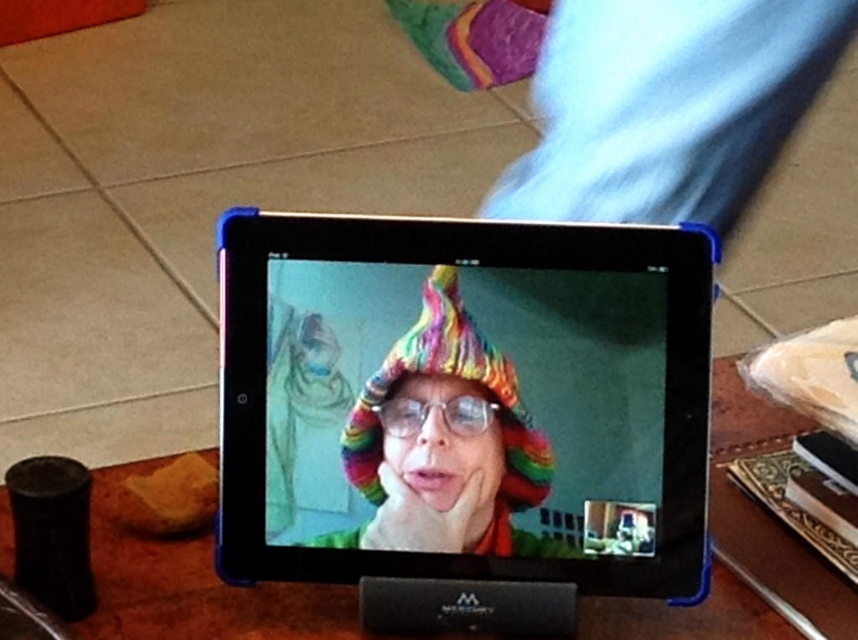
Can you confirm if black plastic tablet at center is positioned below rainbow knitted hat at center?

No, black plastic tablet at center is not below rainbow knitted hat at center.

The width and height of the screenshot is (858, 640). Describe the element at coordinates (464, 394) in the screenshot. I see `black plastic tablet at center` at that location.

Between point (307, 497) and point (469, 314), which one is positioned behind?

The point (307, 497) is behind.

I want to click on black plastic tablet at center, so click(x=464, y=394).

Can you confirm if black plastic tablet at center is smaller than wooden table at center?

Yes.

Can you confirm if black plastic tablet at center is thinner than wooden table at center?

Yes, black plastic tablet at center is thinner than wooden table at center.

Is point (523, 513) in front of point (458, 637)?

That is True.

Find the location of a particular element. This screenshot has width=858, height=640. black plastic tablet at center is located at coordinates (464, 394).

How far apart are wooden table at center and rainbow knitted hat at center?

wooden table at center and rainbow knitted hat at center are 8.06 inches apart from each other.

Does wooden table at center lie behind rainbow knitted hat at center?

That is False.

At what (x,y) coordinates should I click in order to perform the action: click on wooden table at center. Please return your answer as a coordinate pair (x, y). This screenshot has width=858, height=640. Looking at the image, I should click on (740, 548).